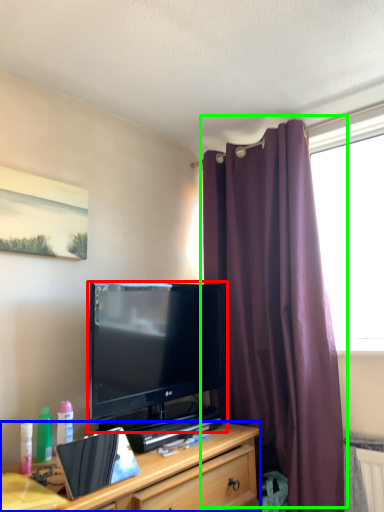
Question: Estimate the real-world distances between objects in this image. Which object is closer to television (highlighted by a red box), cabinetry (highlighted by a blue box) or curtain (highlighted by a green box)?

Choices:
 (A) cabinetry
 (B) curtain

Answer: (A)